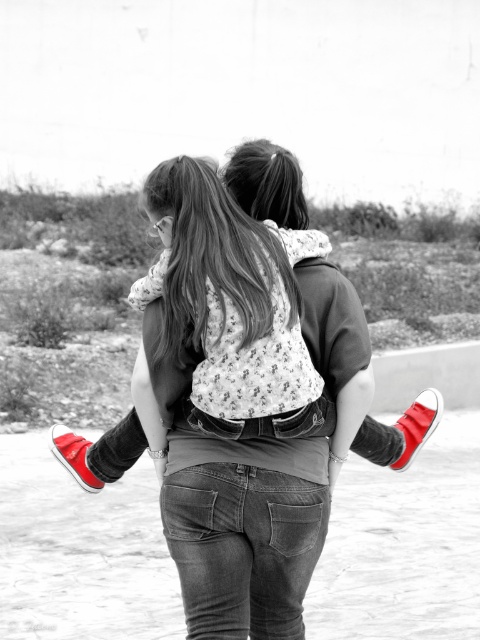
You are a photographer trying to capture a candid shot of the two people in the scene. You need to decide which clothing item to focus on for better visibility. Which clothing item is taller between the matte black shirt at center and the floral fabric dress at center?

The matte black shirt at center is much taller than the floral fabric dress at center, so focusing on the matte black shirt at center would provide better visibility due to its height advantage.

You are a photographer trying to capture the perfect shot of the two subjects in the scene. You notice the matte black shirt at center and the floral fabric dress at center. Which clothing item should you focus on if you want to highlight the one that is positioned to the right?

The matte black shirt at center is to the right of the floral fabric dress at center, so focusing on the matte black shirt at center would highlight the item on the right.